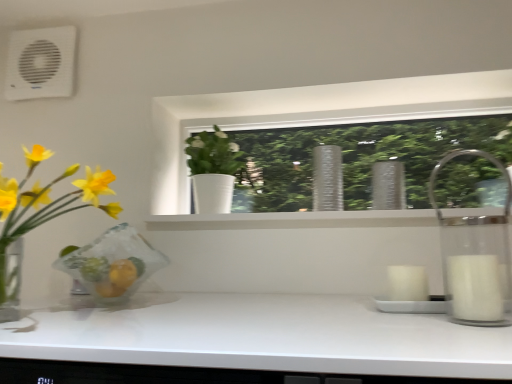
Question: Do you think white plastic air conditioning unit at upper left is within translucent glass vase at left, the first houseplant when ordered from left to right, or outside of it?

Choices:
 (A) inside
 (B) outside

Answer: (B)

Question: From the image's perspective, is white plastic air conditioning unit at upper left positioned above or below translucent glass vase at left, positioned as the second houseplant in right-to-left order?

Choices:
 (A) below
 (B) above

Answer: (B)

Question: Estimate the real-world distances between objects in this image. Which object is closer to the clear glass vase at center?

Choices:
 (A) white plastic air conditioning unit at upper left
 (B) translucent glass vase at left, positioned as the second houseplant in right-to-left order
 (C) white matte pot at center, the 2th houseplant in the left-to-right sequence

Answer: (C)

Question: Estimate the real-world distances between objects in this image. Which object is farther from the translucent glass vase at left, the first houseplant when ordered from left to right?

Choices:
 (A) white matte pot at center, the 1th houseplant in the right-to-left sequence
 (B) clear glass vase at center
 (C) white plastic air conditioning unit at upper left

Answer: (B)